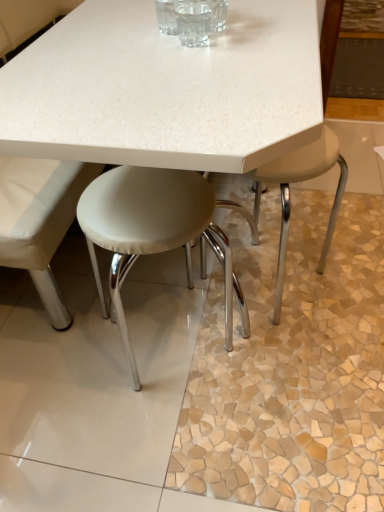
Locate an element on the screen. The image size is (384, 512). vacant space behind white leather stool at center, marked as the 2th stool in a right-to-left arrangement is located at coordinates (178, 272).